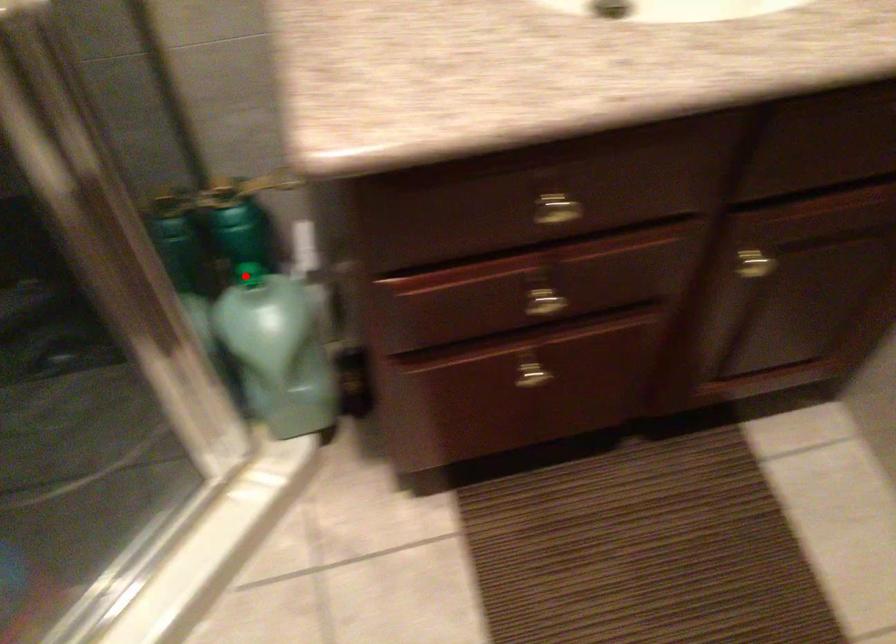
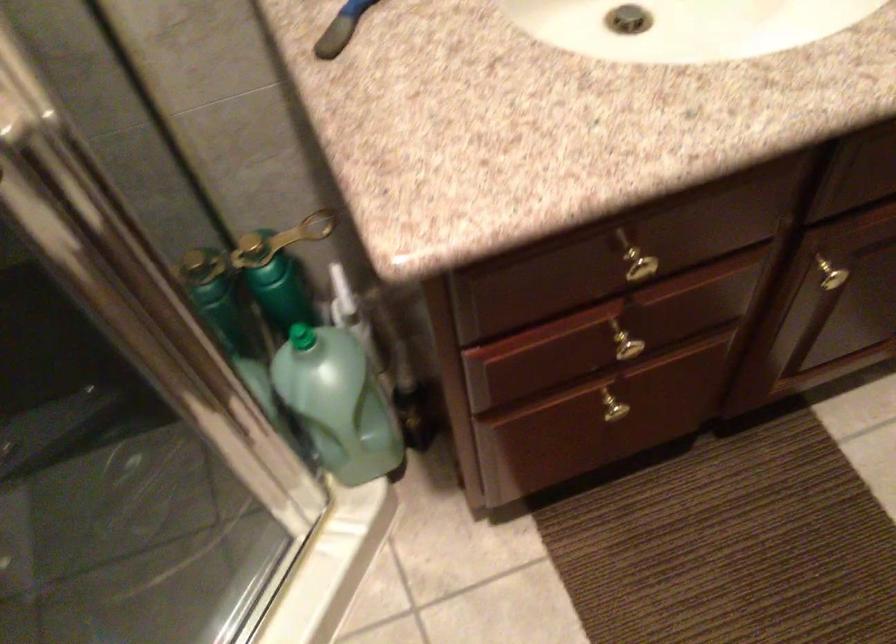
Find the pixel in the second image that matches the highlighted location in the first image.

(300, 337)